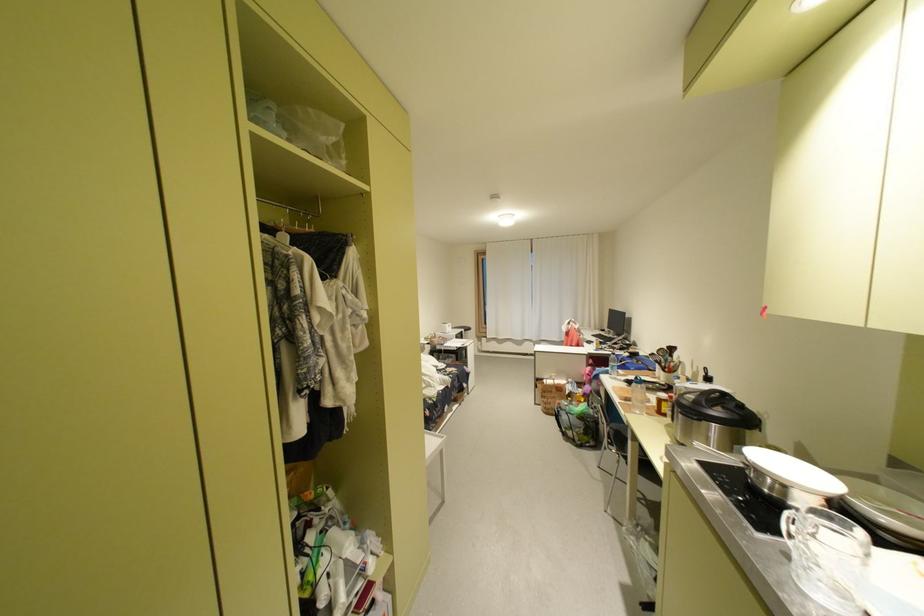
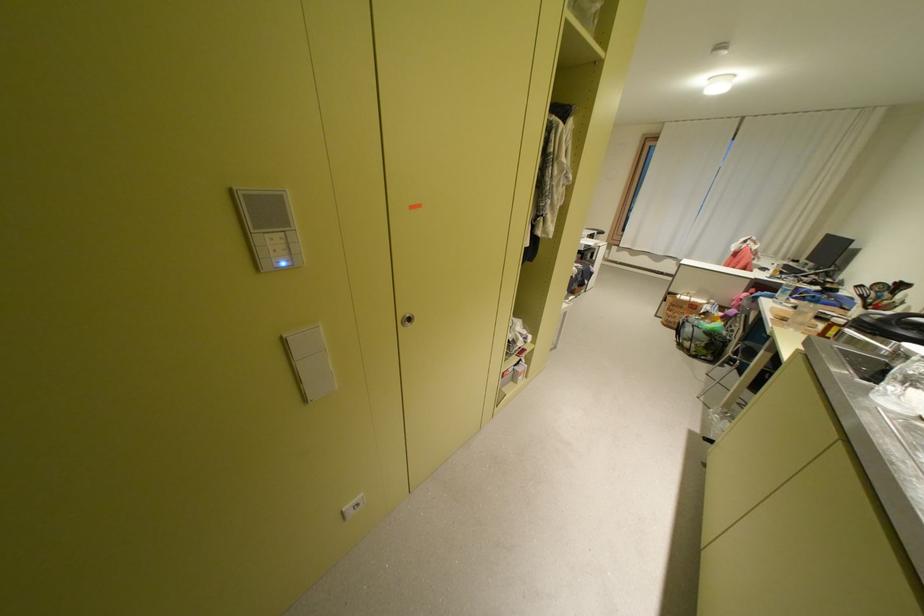
The first image is from the beginning of the video and the second image is from the end. How did the camera likely rotate when shooting the video?

The rotation direction of the camera is left-down.